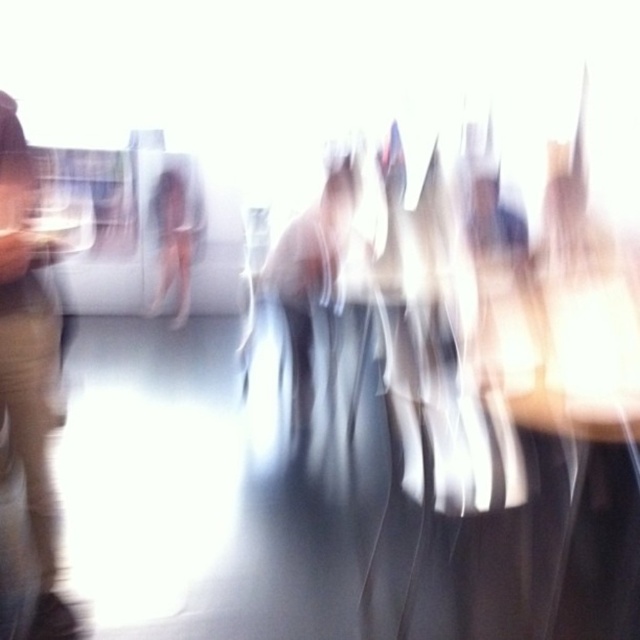
Question: Which of the following is the closest to the observer?

Choices:
 (A) light beige pants at left
 (B) translucent white figure at center

Answer: (A)

Question: Is light beige pants at left wider than translucent white figure at center?

Choices:
 (A) yes
 (B) no

Answer: (B)

Question: Which point is farther from the camera taking this photo?

Choices:
 (A) (28, 356)
 (B) (163, 202)

Answer: (B)

Question: Considering the relative positions of light beige pants at left and translucent white figure at center in the image provided, where is light beige pants at left located with respect to translucent white figure at center?

Choices:
 (A) below
 (B) above

Answer: (A)

Question: Does light beige pants at left have a smaller size compared to translucent white figure at center?

Choices:
 (A) no
 (B) yes

Answer: (B)